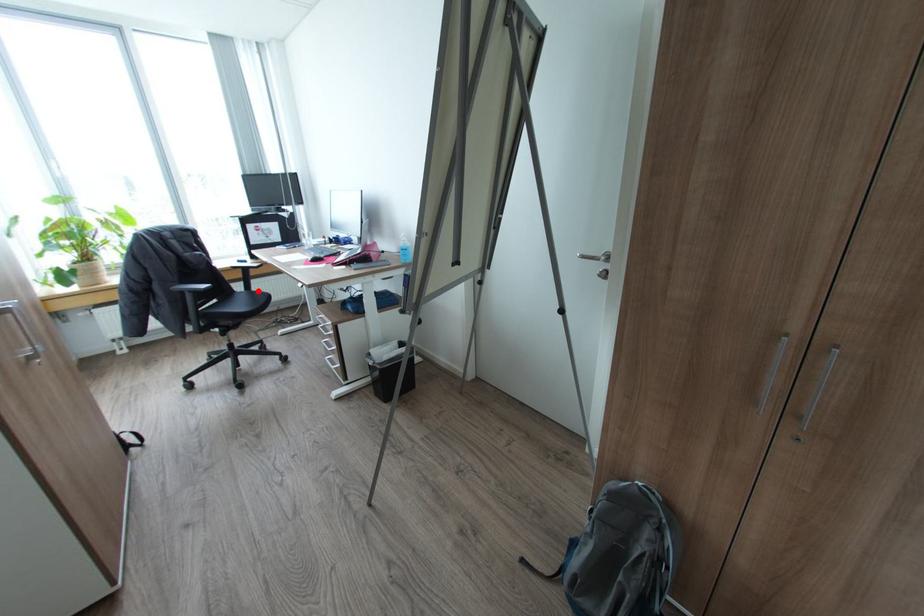
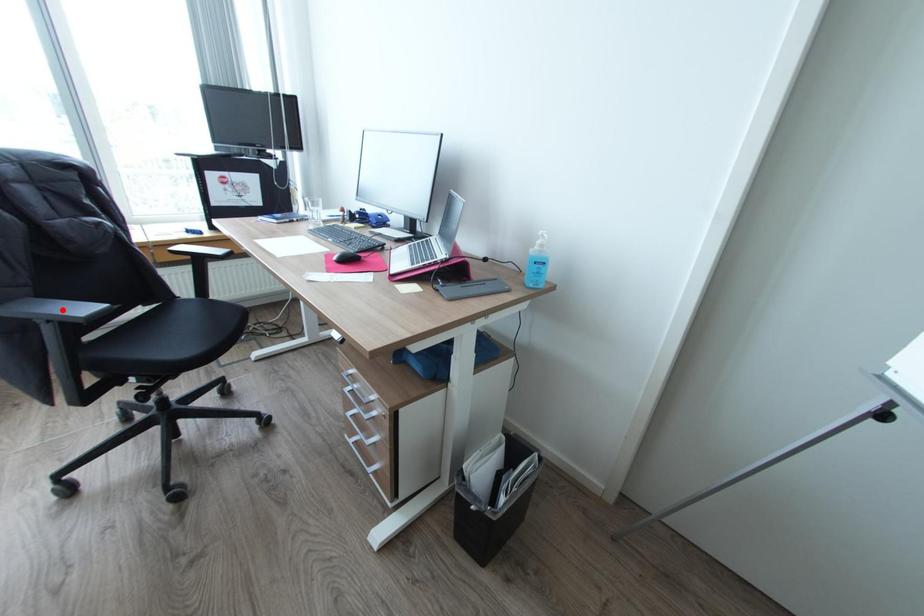
I am providing you with two images of the same scene from different viewpoints. A red point is marked on the first image and another point is marked on the second image. Is the marked point in image1 the same physical position as the marked point in image2?

No